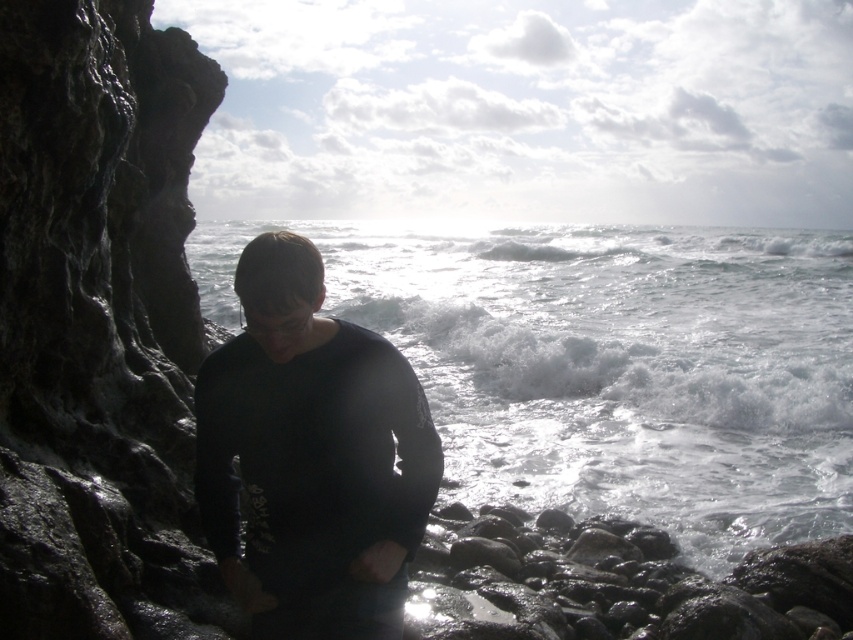
From the picture: You are standing at the center of the image and want to move to the dark gray rocky cliff at left. Which direction should you move in?

You should move to the left to reach the dark gray rocky cliff at left since it is located at the left side of the image.

You are a photographer trying to capture the scene. You notice the white frothy water at center and the black matte shirt at center. Which object is wider in the image?

The white frothy water at center is wider than the black matte shirt at center.

You are standing at the rocky overhang on the left side of the frame. You want to walk to the white frothy water at center. Which direction should you move in to reach it?

The white frothy water at center is located at point (608,364), so you should move towards the right and forward to reach it.